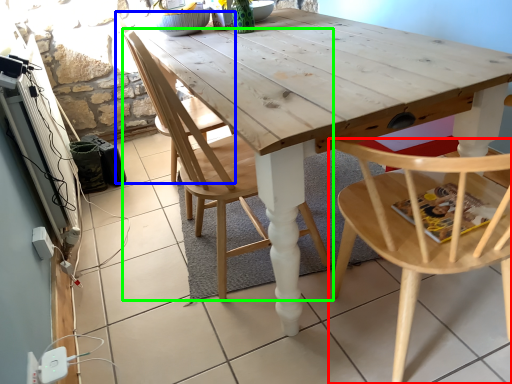
Question: Estimate the real-world distances between objects in this image. Which object is farther from chair (highlighted by a red box), chair (highlighted by a blue box) or chair (highlighted by a green box)?

Choices:
 (A) chair
 (B) chair

Answer: (A)